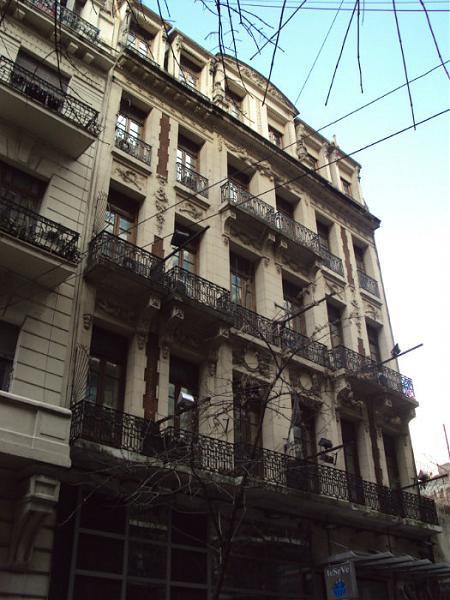
The width and height of the screenshot is (450, 600). I want to click on windows, so click(130, 125), click(183, 388), click(113, 388), click(234, 275), click(186, 260), click(120, 223).